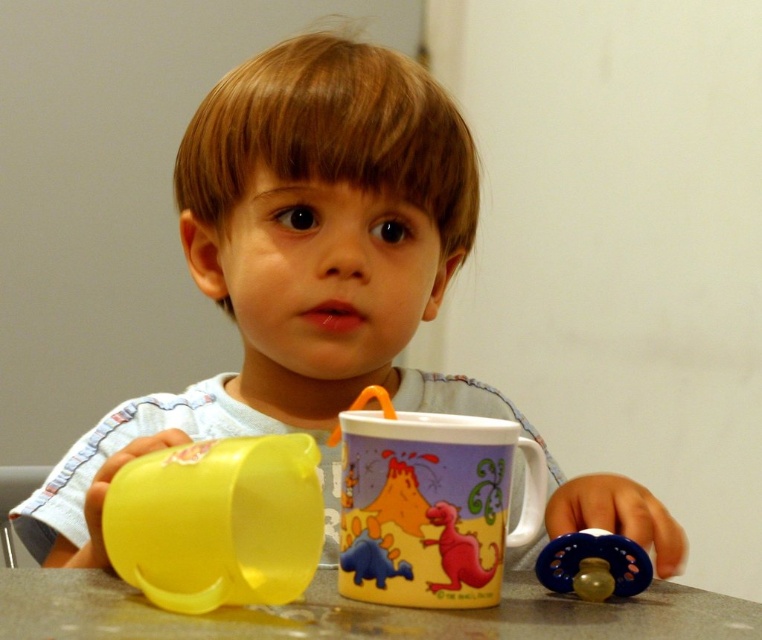
In the scene shown: Who is positioned more to the right, smooth granite table at center or blue rubber pacifier at lower right?

Positioned to the right is blue rubber pacifier at lower right.

Image resolution: width=762 pixels, height=640 pixels. What do you see at coordinates (360, 612) in the screenshot?
I see `smooth granite table at center` at bounding box center [360, 612].

Locate an element on the screen. smooth granite table at center is located at coordinates (360, 612).

Is point (130, 500) behind point (443, 525)?

No, it is in front of (443, 525).

Can you confirm if yellow plastic cup at left is taller than rubberized plastic dinosaur at center?

Indeed, yellow plastic cup at left has a greater height compared to rubberized plastic dinosaur at center.

The height and width of the screenshot is (640, 762). I want to click on yellow plastic cup at left, so click(216, 522).

Which of these two, smooth granite table at center or yellow plastic cup at left, stands taller?

yellow plastic cup at left

Who is more distant from viewer, (357,609) or (258,497)?

Positioned behind is point (258,497).

What do you see at coordinates (360, 612) in the screenshot? I see `smooth granite table at center` at bounding box center [360, 612].

At what (x,y) coordinates should I click in order to perform the action: click on smooth granite table at center. Please return your answer as a coordinate pair (x, y). Image resolution: width=762 pixels, height=640 pixels. Looking at the image, I should click on (360, 612).